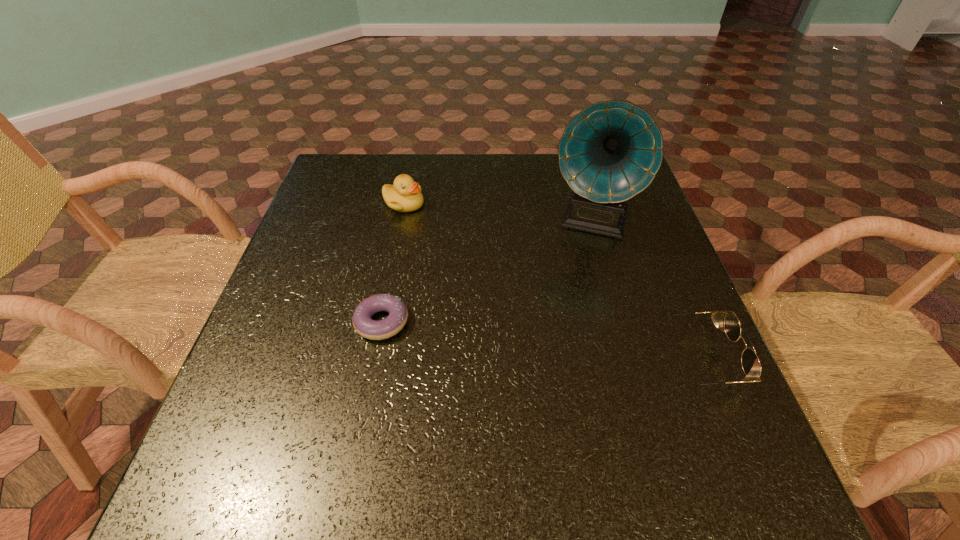
Identify the location of doughnut. (383, 329).

You are a GUI agent. You are given a task and a screenshot of the screen. Output one action in this format:
    pyautogui.click(x=<x>, y=<y>)
    Task: Click on the sunglasses
    Image resolution: width=960 pixels, height=540 pixels.
    Given the screenshot: What is the action you would take?
    pyautogui.click(x=750, y=362)

You are a GUI agent. You are given a task and a screenshot of the screen. Output one action in this format:
    pyautogui.click(x=<x>, y=<y>)
    Task: Click on the duckling
    
    Given the screenshot: What is the action you would take?
    pyautogui.click(x=405, y=195)

Where is `the tallest object`? The image size is (960, 540). the tallest object is located at coordinates 611,151.

Identify the location of vacant space located on the left of the doughnut. The width and height of the screenshot is (960, 540). (276, 322).

Locate an element on the screen. The height and width of the screenshot is (540, 960). blank area located on the beak of the duckling is located at coordinates (471, 274).

The height and width of the screenshot is (540, 960). In order to click on free space located on the beak of the duckling in this screenshot , I will do `click(469, 272)`.

This screenshot has height=540, width=960. In order to click on vacant region located 0.180m on the beak of the duckling in this screenshot , I will do `click(450, 252)`.

This screenshot has width=960, height=540. Identify the location of vacant space located from the horn of the tallest object. (557, 354).

In order to click on vacant space located 0.280m from the horn of the tallest object in this screenshot , I will do `click(560, 342)`.